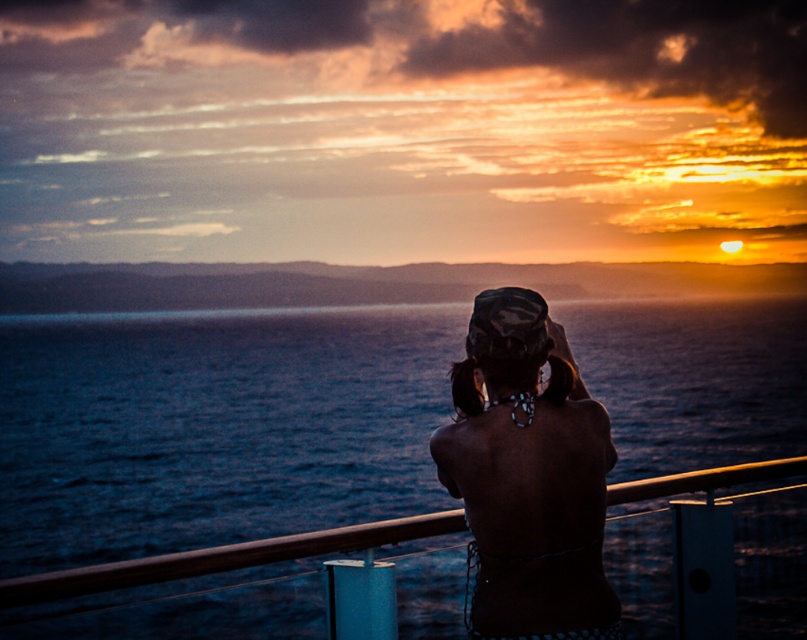
You are on the deck of a ship and want to take a photo of the dark blue water at center. Where should you point your camera to capture it?

You should point your camera at the coordinates point (214, 428) to capture the dark blue water at center.

Based on the photo, you are a photographer trying to capture the sunset scene. You notice the matte black bikini top at center and the black matte hat at center in your frame. Which object should you zoom in on if you want to focus on the larger one?

The matte black bikini top at center is bigger than the black matte hat at center, so you should zoom in on the matte black bikini top at center.

You are a photographer trying to capture the sunset scene. You notice the dark blue water at center and the matte black bikini top at center. Which object occupies more horizontal space in the image?

The dark blue water at center is wider than the matte black bikini top at center, so it occupies more horizontal space in the image.